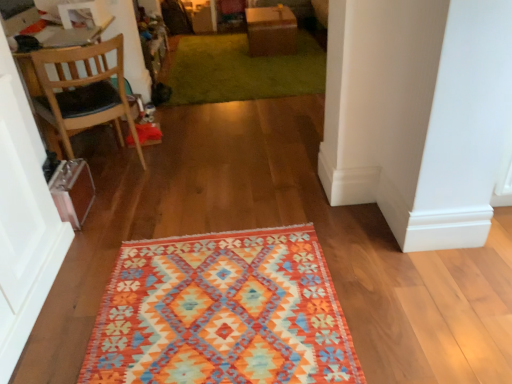
Question: Based on their sizes in the image, would you say green shaggy rug at upper center is bigger or smaller than wooden chair at left?

Choices:
 (A) small
 (B) big

Answer: (A)

Question: Is green shaggy rug at upper center to the left or to the right of wooden chair at left in the image?

Choices:
 (A) right
 (B) left

Answer: (A)

Question: Estimate the real-world distances between objects in this image. Which object is farther from the green shaggy rug at upper center?

Choices:
 (A) textured woolen rug at center
 (B) brown cardboard box at upper center
 (C) wooden chair at left

Answer: (A)

Question: Which is nearer to the textured woolen rug at center?

Choices:
 (A) green shaggy rug at upper center
 (B) wooden chair at left
 (C) brown cardboard box at upper center

Answer: (B)